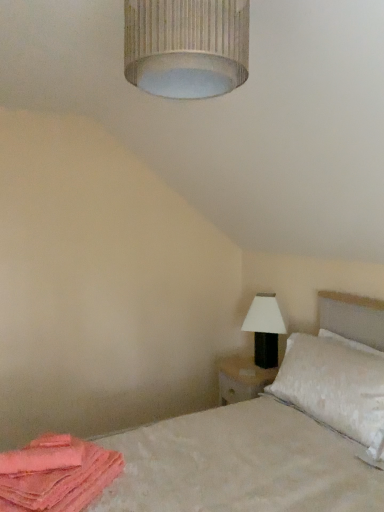
Question: Considering the relative positions of white textured pillow at right and pink fabric at lower left in the image provided, is white textured pillow at right behind pink fabric at lower left?

Choices:
 (A) no
 (B) yes

Answer: (B)

Question: Is white textured pillow at right thinner than pink fabric at lower left?

Choices:
 (A) no
 (B) yes

Answer: (A)

Question: Would you say white textured pillow at right contains pink fabric at lower left?

Choices:
 (A) no
 (B) yes

Answer: (A)

Question: Does white textured pillow at right have a greater height compared to pink fabric at lower left?

Choices:
 (A) no
 (B) yes

Answer: (B)

Question: Can you confirm if white textured pillow at right is shorter than pink fabric at lower left?

Choices:
 (A) yes
 (B) no

Answer: (B)

Question: Looking at the image, does white textured lampshade at upper center seem bigger or smaller compared to white textured bed at lower right?

Choices:
 (A) big
 (B) small

Answer: (B)

Question: Choose the correct answer: Is white textured lampshade at upper center inside white textured bed at lower right or outside it?

Choices:
 (A) inside
 (B) outside

Answer: (B)

Question: Considering the positions of white textured lampshade at upper center and white textured bed at lower right in the image, is white textured lampshade at upper center wider or thinner than white textured bed at lower right?

Choices:
 (A) wide
 (B) thin

Answer: (B)

Question: Is white textured lampshade at upper center taller or shorter than white textured bed at lower right?

Choices:
 (A) tall
 (B) short

Answer: (B)

Question: Considering the positions of point (215, 459) and point (283, 382), is point (215, 459) closer or farther from the camera than point (283, 382)?

Choices:
 (A) closer
 (B) farther

Answer: (A)

Question: Is white textured bed at lower right wider or thinner than white textured pillow at right?

Choices:
 (A) wide
 (B) thin

Answer: (A)

Question: In the image, is white textured bed at lower right positioned in front of or behind white textured pillow at right?

Choices:
 (A) front
 (B) behind

Answer: (A)

Question: Is white textured bed at lower right bigger or smaller than white textured pillow at right?

Choices:
 (A) small
 (B) big

Answer: (B)

Question: From a real-world perspective, is white matte table lamp at right positioned above or below white textured lampshade at upper center?

Choices:
 (A) below
 (B) above

Answer: (A)

Question: Is white matte table lamp at right bigger or smaller than white textured lampshade at upper center?

Choices:
 (A) small
 (B) big

Answer: (B)